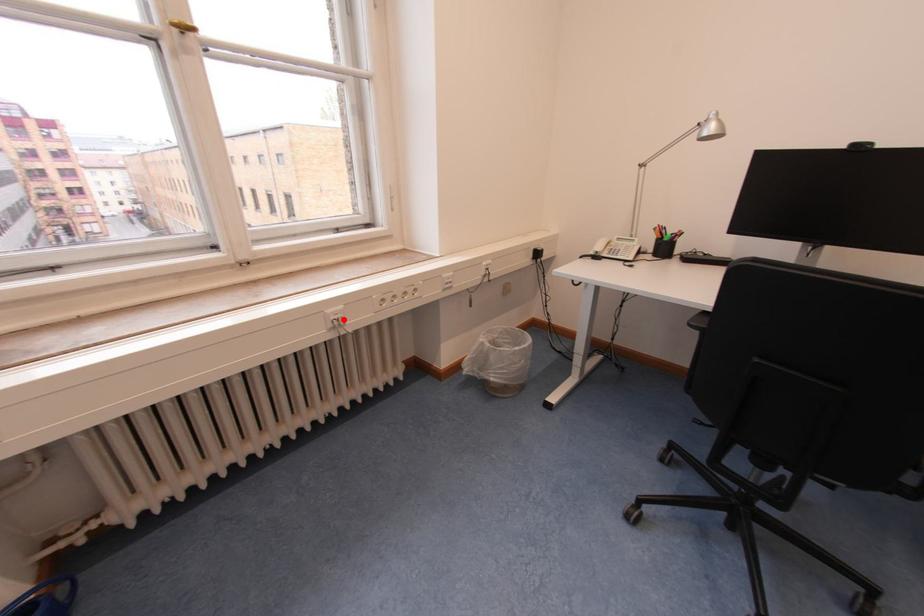
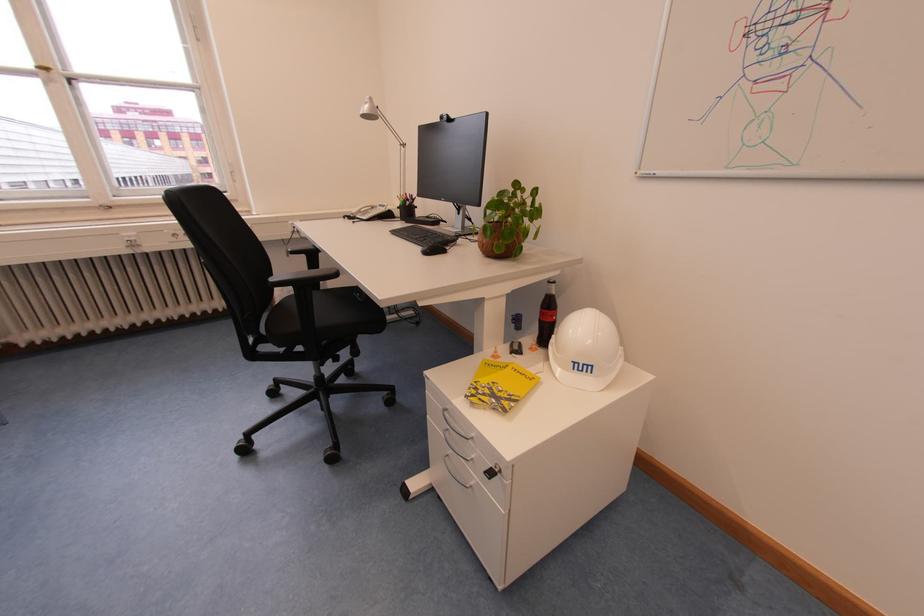
Question: I am providing you with two images of the same scene from different viewpoints. Image1 has a red point marked. In image2, the corresponding 3D location appears at what relative position? Reply with the corresponding letter.

Choices:
 (A) Closer
 (B) Farther

Answer: (B)